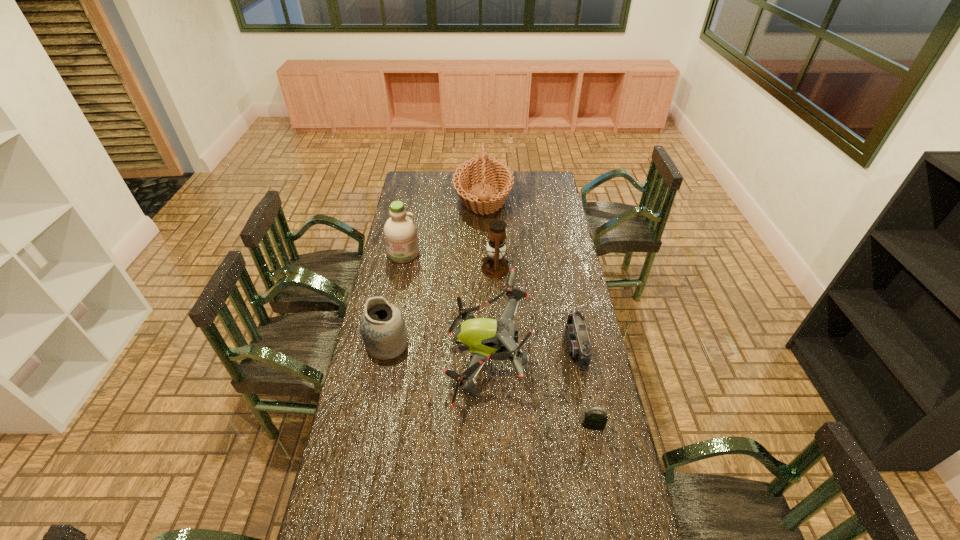
At what (x,y) coordinates should I click in order to perform the action: click on empty location between the pottery and the cleansing agent. Please return your answer as a coordinate pair (x, y). Looking at the image, I should click on (396, 299).

You are a GUI agent. You are given a task and a screenshot of the screen. Output one action in this format:
    pyautogui.click(x=<x>, y=<y>)
    Task: Click on the vacant space that is in between the camcorder and the cleansing agent
    
    Given the screenshot: What is the action you would take?
    pyautogui.click(x=490, y=300)

In order to click on unoccupied position between the farthest object and the cleansing agent in this screenshot , I will do `click(444, 226)`.

Find the location of a particular element. free area in between the drone and the cleansing agent is located at coordinates (444, 307).

The width and height of the screenshot is (960, 540). Identify the location of free space that is in between the cleansing agent and the camcorder. (490, 300).

Point out which object is positioned as the fourth nearest to the nearest object. Please provide its 2D coordinates. Your answer should be formatted as a tuple, i.e. [(x, y)], where the tuple contains the x and y coordinates of a point satisfying the conditions above.

[(495, 265)]

Where is `object that is the fourth nearest to the padlock`? object that is the fourth nearest to the padlock is located at coordinates (495, 265).

Where is `free region that satisfies the following two spatial constraints: 1. on the side of the nearest object, there is a wick adjustment knob; 2. on the right side of the lantern`? This screenshot has height=540, width=960. free region that satisfies the following two spatial constraints: 1. on the side of the nearest object, there is a wick adjustment knob; 2. on the right side of the lantern is located at coordinates (501, 426).

Image resolution: width=960 pixels, height=540 pixels. I want to click on free location that satisfies the following two spatial constraints: 1. on the front-facing side of the nearest object; 2. on the right side of the camcorder, so click(591, 426).